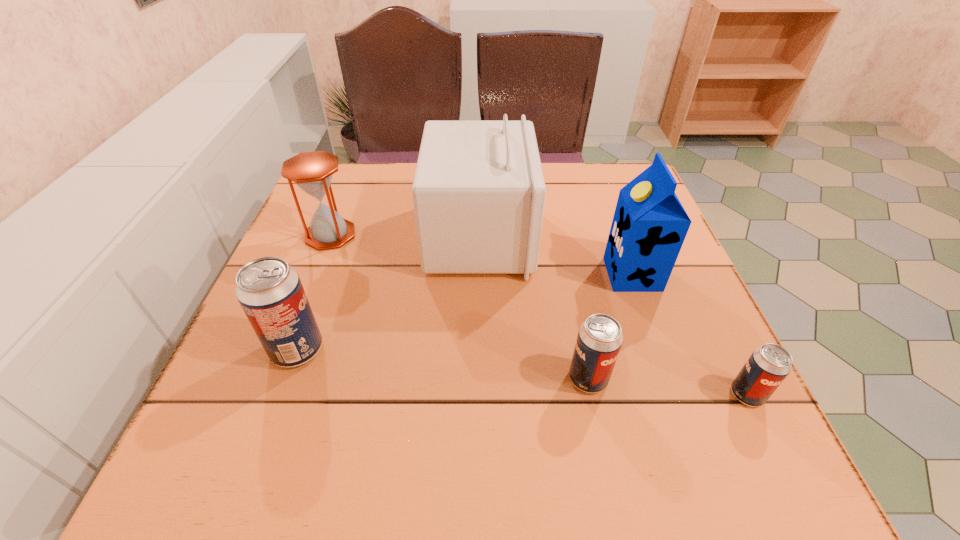
Locate an element on the screen. This screenshot has width=960, height=540. free space between the shortest object and the hourglass is located at coordinates (539, 315).

Locate an element on the screen. The height and width of the screenshot is (540, 960). vacant region between the shortest beer can and the carton is located at coordinates (689, 334).

Where is `empty location between the tallest beer can and the second shortest beer can`? empty location between the tallest beer can and the second shortest beer can is located at coordinates (443, 364).

The image size is (960, 540). I want to click on free space between the rightmost object and the third object from right to left, so click(x=667, y=387).

In order to click on empty space that is in between the third object from left to right and the hourglass in this screenshot , I will do `click(405, 235)`.

Locate an element on the screen. The height and width of the screenshot is (540, 960). vacant area between the leftmost beer can and the carton is located at coordinates (465, 312).

This screenshot has height=540, width=960. What are the coordinates of `free space between the third object from left to right and the second shortest object` in the screenshot? It's located at (534, 308).

Identify which object is located as the fifth nearest to the leftmost beer can. Please provide its 2D coordinates. Your answer should be formatted as a tuple, i.e. [(x, y)], where the tuple contains the x and y coordinates of a point satisfying the conditions above.

[(767, 367)]

Select which object is the fifth closest to the second beer can from right to left. Please provide its 2D coordinates. Your answer should be formatted as a tuple, i.e. [(x, y)], where the tuple contains the x and y coordinates of a point satisfying the conditions above.

[(312, 171)]

Where is `beer can that is the closest to the tallest beer can`? This screenshot has height=540, width=960. beer can that is the closest to the tallest beer can is located at coordinates (599, 340).